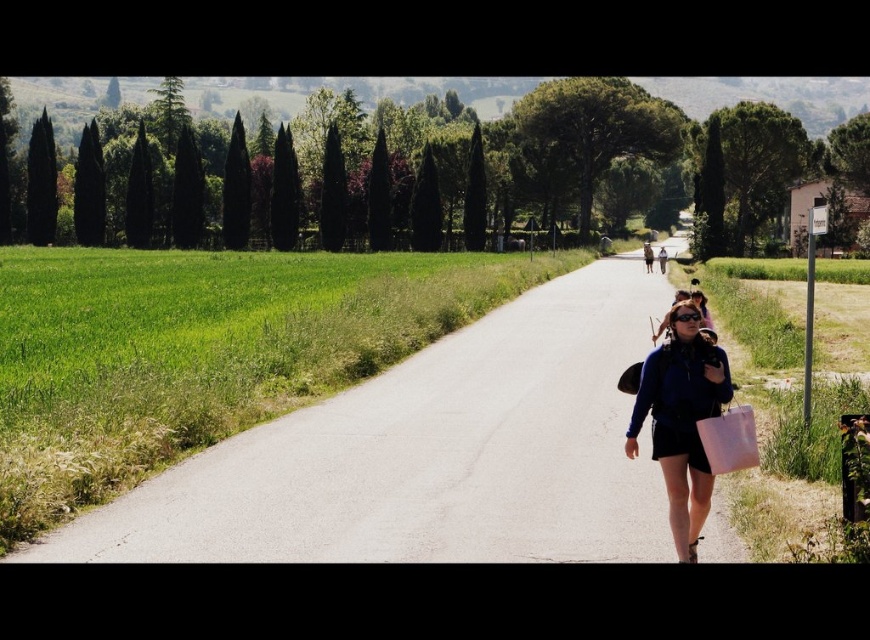
Question: Which of the following is the farthest from the observer?

Choices:
 (A) (239, 550)
 (B) (710, 420)

Answer: (A)

Question: Which object is the closest to the white fabric bag at lower right?

Choices:
 (A) matte blue jacket at center
 (B) smooth asphalt road at center

Answer: (A)

Question: Can you confirm if smooth asphalt road at center is positioned to the right of matte blue jacket at center?

Choices:
 (A) yes
 (B) no

Answer: (A)

Question: Does matte blue jacket at center appear on the left side of white fabric bag at lower right?

Choices:
 (A) yes
 (B) no

Answer: (A)

Question: Where is matte blue jacket at center located in relation to white fabric bag at lower right in the image?

Choices:
 (A) above
 (B) below

Answer: (A)

Question: Estimate the real-world distances between objects in this image. Which object is farther from the matte blue jacket at center?

Choices:
 (A) white fabric bag at lower right
 (B) smooth asphalt road at center

Answer: (B)